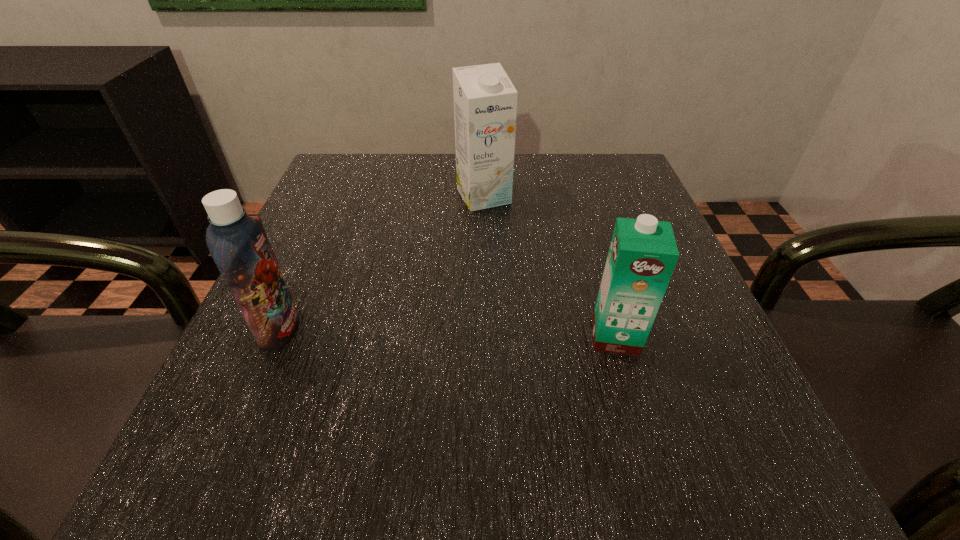
Where is `free space between the shampoo and the nearer carton`? free space between the shampoo and the nearer carton is located at coordinates (447, 333).

What are the coordinates of `vacant space in between the shampoo and the farther carton` in the screenshot? It's located at (382, 263).

At what (x,y) coordinates should I click in order to perform the action: click on blank region between the shorter carton and the shampoo. Please return your answer as a coordinate pair (x, y). This screenshot has width=960, height=540. Looking at the image, I should click on (447, 333).

Locate an element on the screen. This screenshot has height=540, width=960. free area in between the right carton and the shampoo is located at coordinates (447, 333).

Where is `free space that is in between the shorter carton and the leftmost object`? Image resolution: width=960 pixels, height=540 pixels. free space that is in between the shorter carton and the leftmost object is located at coordinates (447, 333).

The image size is (960, 540). Identify the location of unoccupied position between the rightmost object and the taller carton. (550, 266).

Where is `free spot between the left carton and the shortest object`? This screenshot has width=960, height=540. free spot between the left carton and the shortest object is located at coordinates (550, 266).

The height and width of the screenshot is (540, 960). What are the coordinates of `free space between the rightmost object and the shampoo` in the screenshot? It's located at (447, 333).

Where is `the closest object to the farthest object`? The height and width of the screenshot is (540, 960). the closest object to the farthest object is located at coordinates (643, 253).

Point out which object is positioned as the second nearest to the farthest object. Please provide its 2D coordinates. Your answer should be formatted as a tuple, i.e. [(x, y)], where the tuple contains the x and y coordinates of a point satisfying the conditions above.

[(238, 243)]